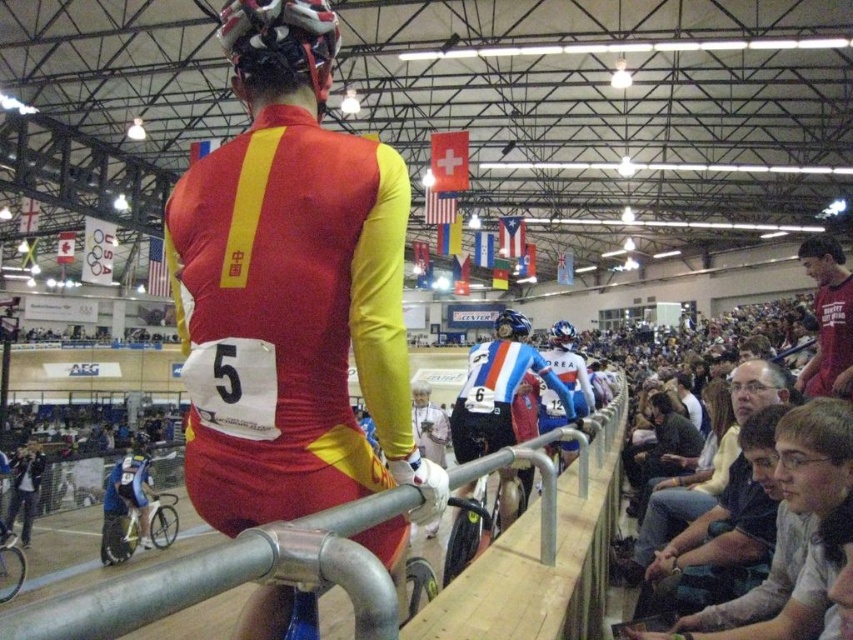
The height and width of the screenshot is (640, 853). Describe the element at coordinates (280, 44) in the screenshot. I see `shiny metallic helmet at upper center` at that location.

Consider the image. Between shiny metallic helmet at upper center and matte red shirt at right, which one appears on the right side from the viewer's perspective?

matte red shirt at right

Identify the location of shiny metallic helmet at upper center. The width and height of the screenshot is (853, 640). (280, 44).

The image size is (853, 640). Identify the location of shiny metallic helmet at upper center. (280, 44).

Where is `silver metallic rail at center`? silver metallic rail at center is located at coordinates (231, 579).

Is silver metallic rail at center positioned in front of shiny blue helmet at center?

That is True.

Between point (549, 532) and point (558, 340), which one is positioned behind?

Point (558, 340)

Identify the location of silver metallic rail at center. (231, 579).

Based on the photo, does matte red and yellow cycling suit at center lie behind blue glossy bicycle helmet at center?

That is False.

Who is higher up, matte red and yellow cycling suit at center or blue glossy bicycle helmet at center?

Positioned higher is blue glossy bicycle helmet at center.

I want to click on matte red and yellow cycling suit at center, so click(289, 289).